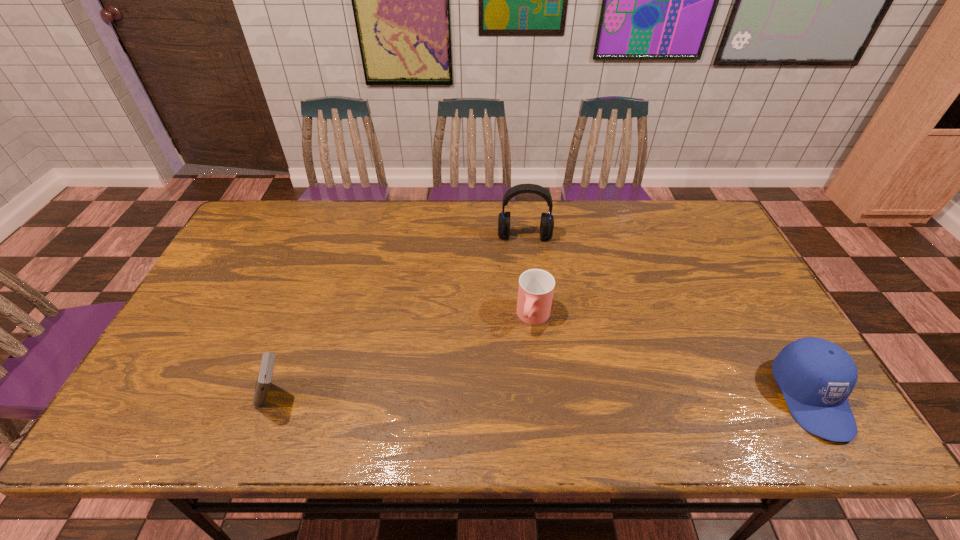
In the image, there is a desktop. What are the coordinates of `vacant space at the left edge` in the screenshot? It's located at (173, 348).

The height and width of the screenshot is (540, 960). In the image, there is a desktop. Find the location of `vacant space at the far right corner`. vacant space at the far right corner is located at coordinates (705, 207).

You are a GUI agent. You are given a task and a screenshot of the screen. Output one action in this format:
    pyautogui.click(x=<x>, y=<y>)
    Task: Click on the free area in between the calculator and the rightmost object
    
    Given the screenshot: What is the action you would take?
    pyautogui.click(x=542, y=397)

Locate an element on the screen. Image resolution: width=960 pixels, height=540 pixels. free space between the cup and the rightmost object is located at coordinates (673, 357).

The image size is (960, 540). Find the location of `vacant area that lies between the second farthest object and the cap`. vacant area that lies between the second farthest object and the cap is located at coordinates (673, 357).

I want to click on vacant space that's between the third nearest object and the calculator, so click(x=404, y=357).

What are the coordinates of `vacant point located between the leftmost object and the second farthest object` in the screenshot? It's located at tap(404, 357).

Locate an element on the screen. Image resolution: width=960 pixels, height=540 pixels. vacant area between the second farthest object and the cap is located at coordinates (673, 357).

Identify the location of blank region between the rightmost object and the tallest object. (668, 316).

Find the location of a particular element. empty space that is in between the headset and the rightmost object is located at coordinates (668, 316).